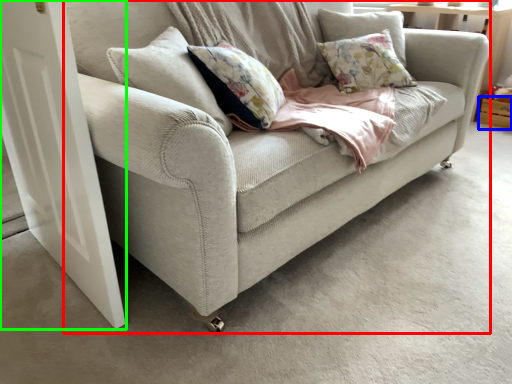
Question: Estimate the real-world distances between objects in this image. Which object is closer to studio couch (highlighted by a red box), drawer (highlighted by a blue box) or screen door (highlighted by a green box)?

Choices:
 (A) drawer
 (B) screen door

Answer: (B)